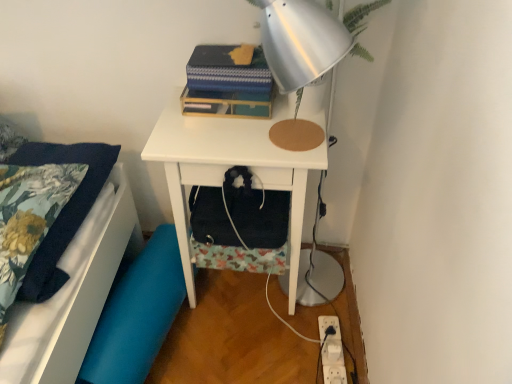
Identify the location of vacant space in between white matte nightstand at center and blue fabric swivel chair at lower left. The width and height of the screenshot is (512, 384). (207, 349).